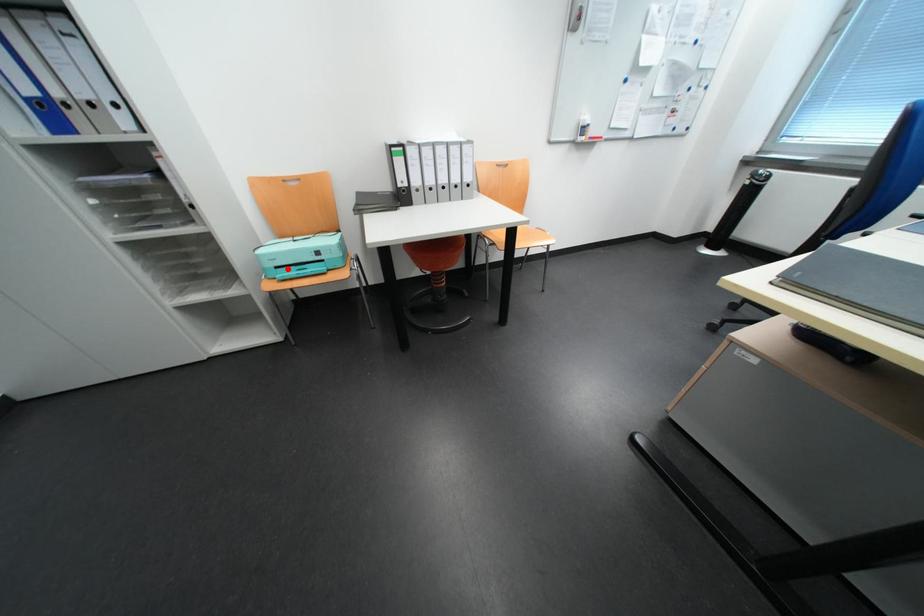
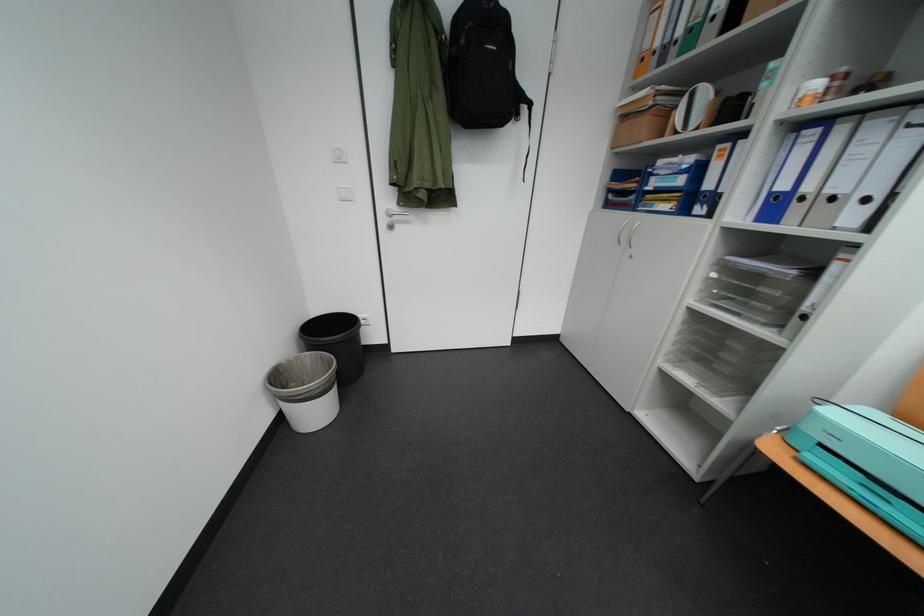
Locate, in the second image, the point that corresponds to the highlighted location in the first image.

(833, 447)